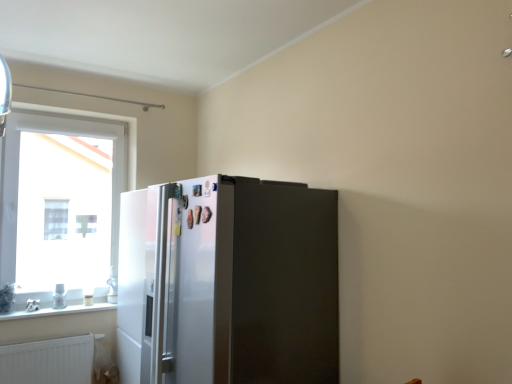
In order to face white glossy window sill at lower left, should I rotate leftwards or rightwards?

To face it directly, rotate left by 24.266 degrees.

Measure the distance between white matte radiator at lower left and camera.

white matte radiator at lower left is 2.63 meters away from camera.

This screenshot has width=512, height=384. Describe the element at coordinates (60, 204) in the screenshot. I see `clear glass window at left` at that location.

In order to click on satin silver refrigerator at center in this screenshot , I will do `click(228, 282)`.

Does clear glass window at left have a smaller size compared to white matte radiator at lower left?

Incorrect, clear glass window at left is not smaller in size than white matte radiator at lower left.

Considering the sizes of objects clear glass window at left and white matte radiator at lower left in the image provided, who is thinner, clear glass window at left or white matte radiator at lower left?

With smaller width is white matte radiator at lower left.

Considering the relative positions of clear glass window at left and white matte radiator at lower left in the image provided, is clear glass window at left to the right of white matte radiator at lower left from the viewer's perspective?

Incorrect, clear glass window at left is not on the right side of white matte radiator at lower left.

Considering the sizes of objects clear glass window at left and white matte radiator at lower left in the image provided, who is shorter, clear glass window at left or white matte radiator at lower left?

white matte radiator at lower left is shorter.

Which is more distant, (x=106, y=304) or (x=32, y=344)?

The point (x=106, y=304) is farther.

Is white glossy window sill at lower left aimed at white matte radiator at lower left?

No, white glossy window sill at lower left is not oriented towards white matte radiator at lower left.

Is white glossy window sill at lower left inside the boundaries of white matte radiator at lower left, or outside?

white glossy window sill at lower left cannot be found inside white matte radiator at lower left.

From a real-world perspective, relative to white matte radiator at lower left, is white glossy window sill at lower left vertically above or below?

white glossy window sill at lower left is above white matte radiator at lower left.

Could you tell me if white matte radiator at lower left is turned towards satin silver refrigerator at center?

No, white matte radiator at lower left is not aimed at satin silver refrigerator at center.

Can you confirm if white matte radiator at lower left is shorter than satin silver refrigerator at center?

Yes, white matte radiator at lower left is shorter than satin silver refrigerator at center.

From a real-world perspective, relative to white glossy window sill at lower left, is white matte radiator at lower left vertically above or below?

From a real-world perspective, white matte radiator at lower left is physically below white glossy window sill at lower left.

Is white matte radiator at lower left outside of white glossy window sill at lower left?

Absolutely, white matte radiator at lower left is external to white glossy window sill at lower left.

This screenshot has height=384, width=512. In order to click on window sill above the white matte radiator at lower left (from the image's perspective) in this screenshot , I will do `click(61, 309)`.

Can you tell me how much white matte radiator at lower left and white glossy window sill at lower left differ in facing direction?

white matte radiator at lower left and white glossy window sill at lower left are facing 0.000933 degrees away from each other.

From the image's perspective, would you say satin silver refrigerator at center is shown under white glossy window sill at lower left?

Actually, satin silver refrigerator at center appears above white glossy window sill at lower left in the image.

Are satin silver refrigerator at center and white glossy window sill at lower left located far from each other?

Absolutely, satin silver refrigerator at center is distant from white glossy window sill at lower left.

Is satin silver refrigerator at center bigger than white glossy window sill at lower left?

Indeed, satin silver refrigerator at center has a larger size compared to white glossy window sill at lower left.

Between satin silver refrigerator at center and white glossy window sill at lower left, which one has less height?

Standing shorter between the two is white glossy window sill at lower left.

Is point (84, 349) less distant than point (29, 294)?

Yes, point (84, 349) is in front of point (29, 294).

The width and height of the screenshot is (512, 384). Find the location of `window that is above the white matte radiator at lower left (from a real-world perspective)`. window that is above the white matte radiator at lower left (from a real-world perspective) is located at coordinates (60, 204).

From the image's perspective, would you say white matte radiator at lower left is shown under clear glass window at left?

Indeed, from the image's perspective, white matte radiator at lower left is shown beneath clear glass window at left.

Is white matte radiator at lower left not near clear glass window at left?

white matte radiator at lower left is positioned a significant distance from clear glass window at left.

Is white glossy window sill at lower left turned away from clear glass window at left?

That's not correct — white glossy window sill at lower left is not looking away from clear glass window at left.

Which object is more forward, white glossy window sill at lower left or clear glass window at left?

Positioned in front is white glossy window sill at lower left.

Who is shorter, white glossy window sill at lower left or clear glass window at left?

white glossy window sill at lower left.

This screenshot has height=384, width=512. What are the coordinates of `window on the left of white matte radiator at lower left` in the screenshot? It's located at (60, 204).

In order to click on window sill located behind the white matte radiator at lower left in this screenshot , I will do `click(61, 309)`.

Considering their positions, is satin silver refrigerator at center positioned closer to white glossy window sill at lower left than clear glass window at left?

clear glass window at left lies closer to white glossy window sill at lower left than the other object.

Looking at the image, which one is located closer to clear glass window at left, white matte radiator at lower left or satin silver refrigerator at center?

white matte radiator at lower left lies closer to clear glass window at left than the other object.

Based on their spatial positions, is clear glass window at left or white glossy window sill at lower left further from white matte radiator at lower left?

clear glass window at left is further to white matte radiator at lower left.

In the scene shown: When comparing their distances from white matte radiator at lower left, does clear glass window at left or satin silver refrigerator at center seem closer?

The object closer to white matte radiator at lower left is clear glass window at left.

Which object lies further to the anchor point clear glass window at left, white glossy window sill at lower left or white matte radiator at lower left?

white matte radiator at lower left is further to clear glass window at left.

Looking at the image, which one is located closer to white matte radiator at lower left, satin silver refrigerator at center or clear glass window at left?

Based on the image, clear glass window at left appears to be nearer to white matte radiator at lower left.

Looking at the image, which one is located further to satin silver refrigerator at center, white glossy window sill at lower left or white matte radiator at lower left?

Among the two, white glossy window sill at lower left is located further to satin silver refrigerator at center.

Which object lies further to the anchor point white glossy window sill at lower left, clear glass window at left or white matte radiator at lower left?

Based on the image, clear glass window at left appears to be further to white glossy window sill at lower left.

Locate an element on the screen. radiator situated between white glossy window sill at lower left and satin silver refrigerator at center from left to right is located at coordinates (48, 361).

You are a GUI agent. You are given a task and a screenshot of the screen. Output one action in this format:
    pyautogui.click(x=<x>, y=<y>)
    Task: Click on the radiator between clear glass window at left and satin silver refrigerator at center from left to right
    
    Given the screenshot: What is the action you would take?
    pyautogui.click(x=48, y=361)

In order to click on window sill situated between clear glass window at left and satin silver refrigerator at center from left to right in this screenshot , I will do `click(61, 309)`.

This screenshot has width=512, height=384. What are the coordinates of `window sill between clear glass window at left and white matte radiator at lower left from top to bottom` in the screenshot? It's located at (61, 309).